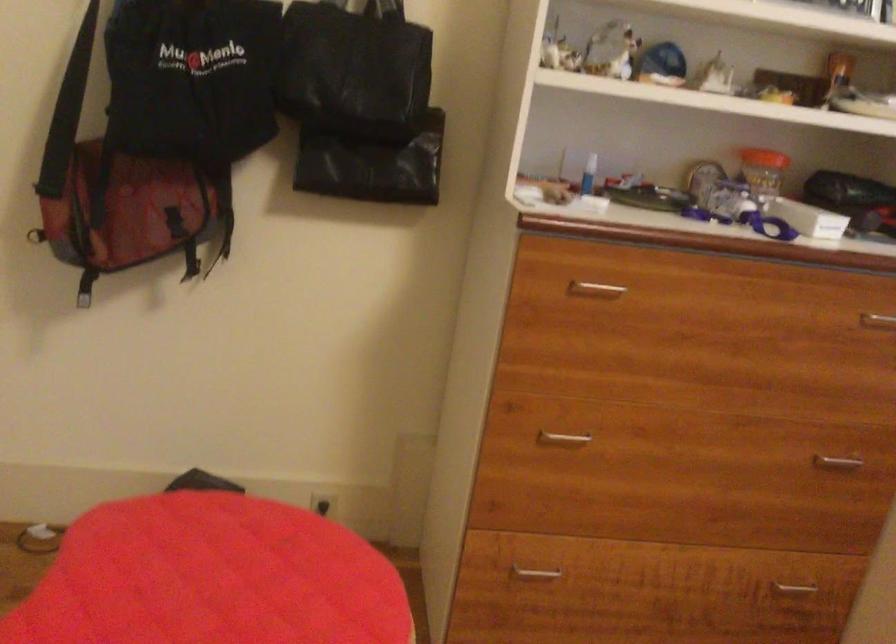
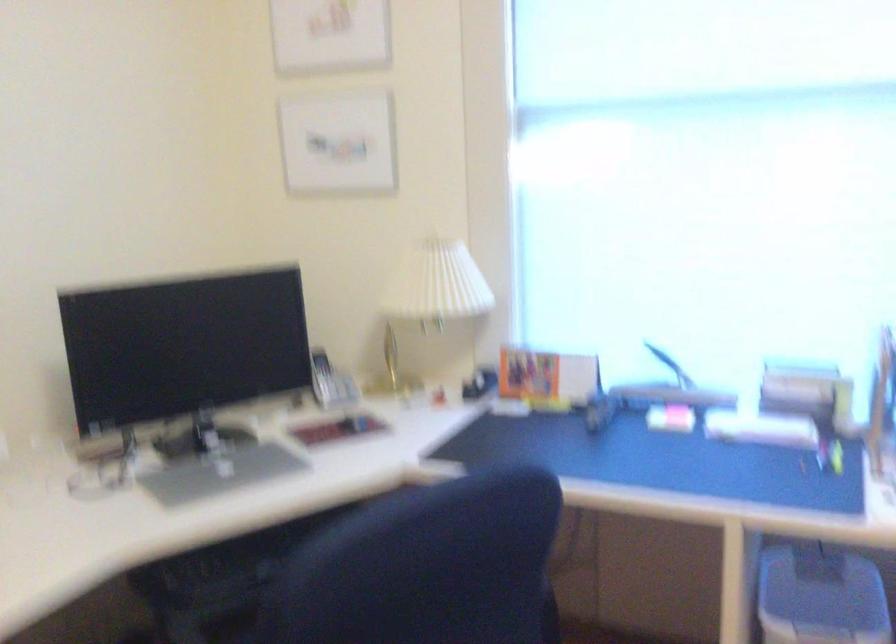
Question: Based on the continuous images, in which direction is the camera rotating? Reply with the corresponding letter.

Choices:
 (A) Left
 (B) Right
 (C) Up
 (D) Down

Answer: (B)